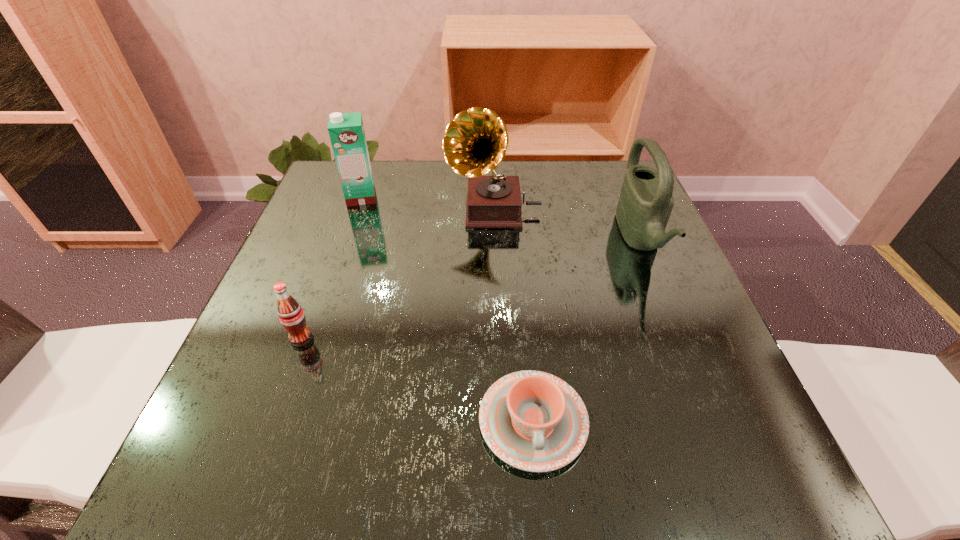
This screenshot has height=540, width=960. In order to click on vacant space situated on the left of the carton in this screenshot , I will do `click(317, 197)`.

At what (x,y) coordinates should I click in order to perform the action: click on vacant region located 0.190m on the spout of the rightmost object. Please return your answer as a coordinate pair (x, y). Looking at the image, I should click on (536, 239).

In order to click on vacant space situated on the spout of the rightmost object in this screenshot , I will do `click(544, 239)`.

Where is `vacant area located on the spout of the rightmost object`? vacant area located on the spout of the rightmost object is located at coordinates (464, 239).

Find the location of a particular element. The height and width of the screenshot is (540, 960). vacant space located 0.090m on the front of the fourth tallest object is located at coordinates coord(281,393).

Image resolution: width=960 pixels, height=540 pixels. Find the location of `phonograph record that is at the far edge`. phonograph record that is at the far edge is located at coordinates (475, 142).

I want to click on carton at the far edge, so click(346, 130).

Locate an element on the screen. watering can that is at the far edge is located at coordinates (646, 201).

Identify the location of object situated at the near edge. (x=533, y=421).

Image resolution: width=960 pixels, height=540 pixels. I want to click on carton situated at the left edge, so click(x=346, y=130).